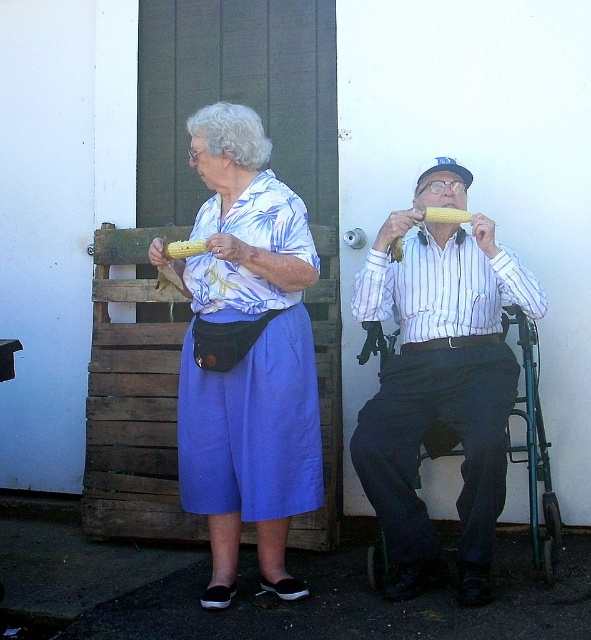
You are a tailor measuring the width of two garments in the image. The matte blue skirt at center and the white striped shirt at center. Which garment has a narrower width?

The matte blue skirt at center has a narrower width than the white striped shirt at center.

You are a photographer trying to capture a closeup of the yellow corn cob at upper center without any obstructions. Given that the white striped shirt at center is in front of it, what should you do to ensure the corn cob is fully visible in your photo?

Move the white striped shirt at center out of the way so that the yellow corn cob at upper center can be seen clearly.

You are a photographer trying to capture a closeup of the matte white shirt at center and the yellow corn at upper center. Which object should you focus on first to ensure it appears sharp in the photo?

The matte white shirt at center should be focused on first because it is located below the yellow corn at upper center, making it closer to the camera. Focusing on the closer object ensures sharpness before adjusting for the other.